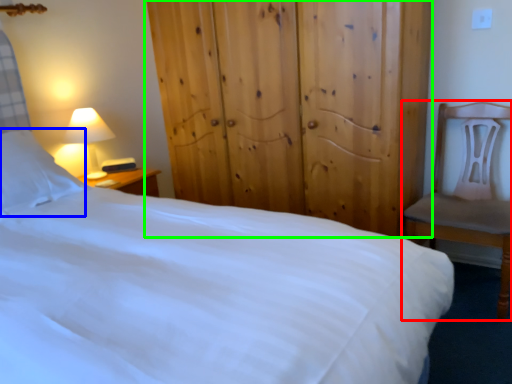
Question: Estimate the real-world distances between objects in this image. Which object is farther from chair (highlighted by a red box), pillow (highlighted by a blue box) or dresser (highlighted by a green box)?

Choices:
 (A) pillow
 (B) dresser

Answer: (A)